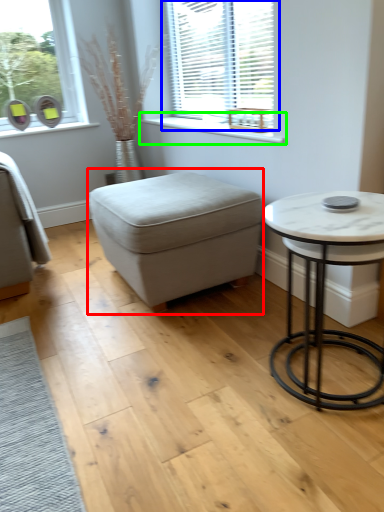
Question: Considering the real-world distances, which object is closest to music stool (highlighted by a red box)? window (highlighted by a blue box) or window sill (highlighted by a green box).

Choices:
 (A) window
 (B) window sill

Answer: (B)